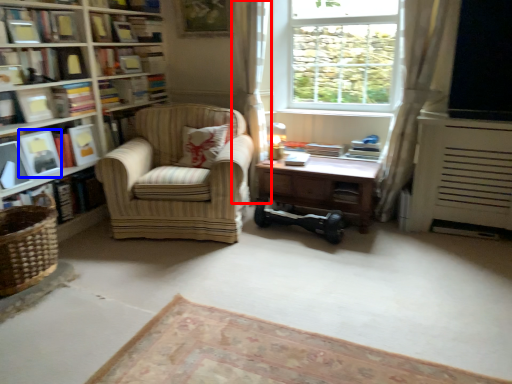
Question: Which object appears farthest to the camera in this image, curtain (highlighted by a red box) or paperback book (highlighted by a blue box)?

Choices:
 (A) curtain
 (B) paperback book

Answer: (A)